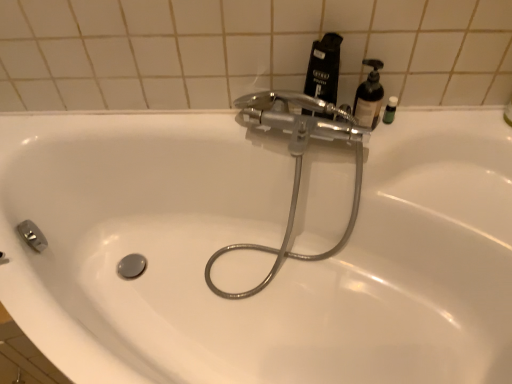
Question: Should I look upward or downward to see translucent plastic soap dispenser at upper right?

Choices:
 (A) up
 (B) down

Answer: (A)

Question: Are translucent plastic soap dispenser at upper right and black matte bottle at upper right located far from each other?

Choices:
 (A) no
 (B) yes

Answer: (A)

Question: Is translucent plastic soap dispenser at upper right looking in the opposite direction of black matte bottle at upper right?

Choices:
 (A) yes
 (B) no

Answer: (B)

Question: Is translucent plastic soap dispenser at upper right next to black matte bottle at upper right and touching it?

Choices:
 (A) yes
 (B) no

Answer: (A)

Question: Does translucent plastic soap dispenser at upper right turn towards black matte bottle at upper right?

Choices:
 (A) yes
 (B) no

Answer: (B)

Question: Can you confirm if translucent plastic soap dispenser at upper right is shorter than black matte bottle at upper right?

Choices:
 (A) yes
 (B) no

Answer: (A)

Question: Is translucent plastic soap dispenser at upper right in front of black matte bottle at upper right?

Choices:
 (A) no
 (B) yes

Answer: (A)

Question: Is polished chrome faucet at upper center aimed at black matte bottle at upper right?

Choices:
 (A) no
 (B) yes

Answer: (A)

Question: From the image's perspective, is polished chrome faucet at upper center on black matte bottle at upper right?

Choices:
 (A) yes
 (B) no

Answer: (B)

Question: Considering the relative sizes of polished chrome faucet at upper center and black matte bottle at upper right in the image provided, is polished chrome faucet at upper center wider than black matte bottle at upper right?

Choices:
 (A) no
 (B) yes

Answer: (B)

Question: Does polished chrome faucet at upper center have a larger size compared to black matte bottle at upper right?

Choices:
 (A) yes
 (B) no

Answer: (A)

Question: From a real-world perspective, is polished chrome faucet at upper center physically above black matte bottle at upper right?

Choices:
 (A) yes
 (B) no

Answer: (B)

Question: Considering the relative sizes of polished chrome faucet at upper center and black matte bottle at upper right in the image provided, is polished chrome faucet at upper center taller than black matte bottle at upper right?

Choices:
 (A) no
 (B) yes

Answer: (B)

Question: Are translucent plastic soap dispenser at upper right and polished chrome faucet at upper center making contact?

Choices:
 (A) no
 (B) yes

Answer: (A)